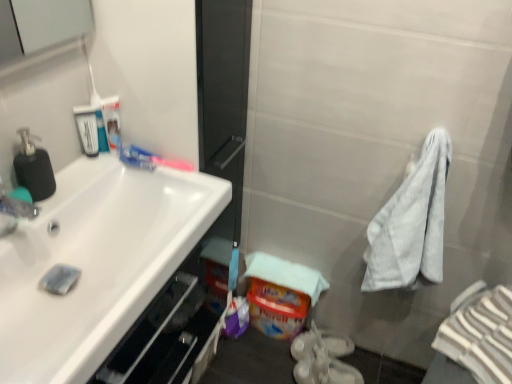
At what (x,y) coordinates should I click in order to perform the action: click on vacant space that is in between white plastic mouthwash at upper left, marked as the 2th mouthwash in a right-to-left arrangement, and matte black soap dispenser at left. Please return your answer as a coordinate pair (x, y). The image size is (512, 384). Looking at the image, I should click on (74, 174).